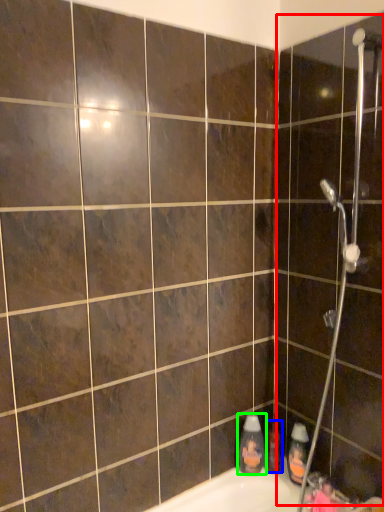
Question: Which is nearer to the screen door (highlighted by a red box)? toiletry (highlighted by a blue box) or cleaning product (highlighted by a green box).

Choices:
 (A) toiletry
 (B) cleaning product

Answer: (B)